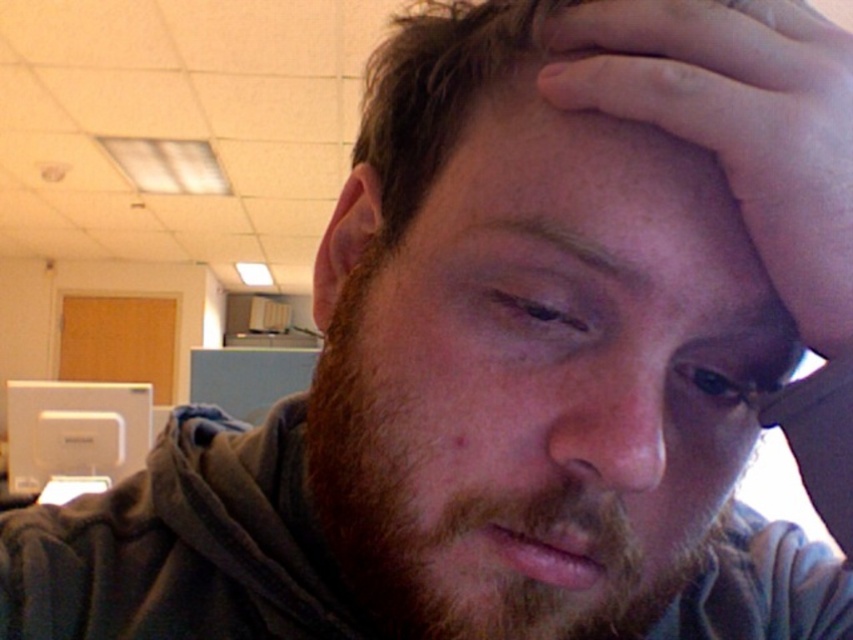
Between point (650, 90) and point (125, 385), which one is positioned in front?

Positioned in front is point (650, 90).

Who is lower down, skinny flesh-toned hand at upper right or white plastic monitor at lower left?

white plastic monitor at lower left is lower down.

Does point (836, 200) come closer to viewer compared to point (80, 397)?

That is True.

Locate an element on the screen. This screenshot has height=640, width=853. skinny flesh-toned hand at upper right is located at coordinates (738, 124).